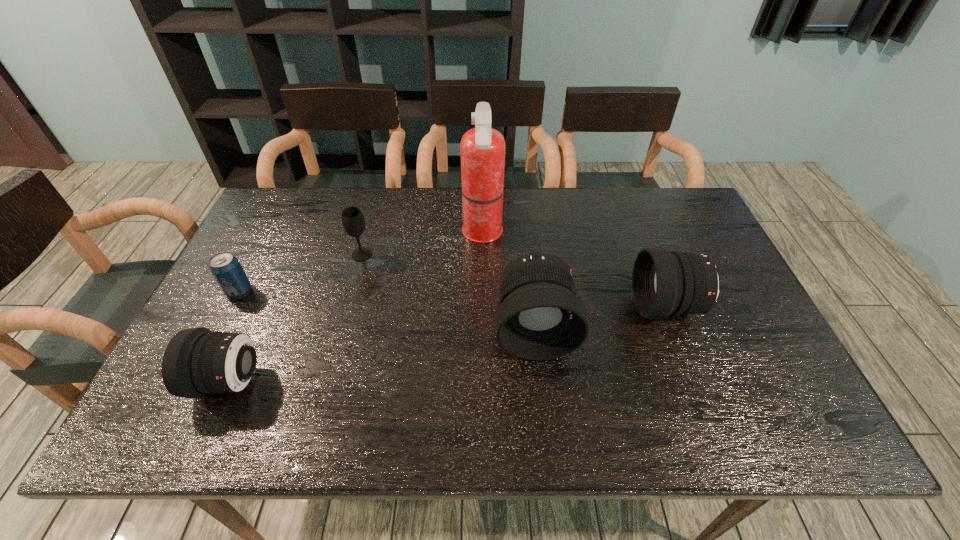
Locate an element on the screen. Image resolution: width=960 pixels, height=540 pixels. telephoto lens present at the left edge is located at coordinates (197, 361).

The width and height of the screenshot is (960, 540). What are the coordinates of `pop soda at the left edge` in the screenshot? It's located at (225, 267).

Locate an element on the screen. object located in the right edge section of the desktop is located at coordinates [x=664, y=283].

Locate an element on the screen. This screenshot has width=960, height=540. object at the near left corner is located at coordinates click(x=197, y=361).

Locate an element on the screen. vacant region at the far edge of the desktop is located at coordinates (521, 195).

In the image, there is a desktop. What are the coordinates of `vacant space at the near edge` in the screenshot? It's located at (638, 363).

Where is `free space at the left edge of the desktop`? The height and width of the screenshot is (540, 960). free space at the left edge of the desktop is located at coordinates (288, 269).

This screenshot has height=540, width=960. I want to click on free location at the right edge, so click(x=667, y=248).

In the image, there is a desktop. Where is `vacant space at the far right corner`? The height and width of the screenshot is (540, 960). vacant space at the far right corner is located at coordinates (640, 192).

Where is `vacant space at the near right corner of the desktop`? The image size is (960, 540). vacant space at the near right corner of the desktop is located at coordinates (786, 382).